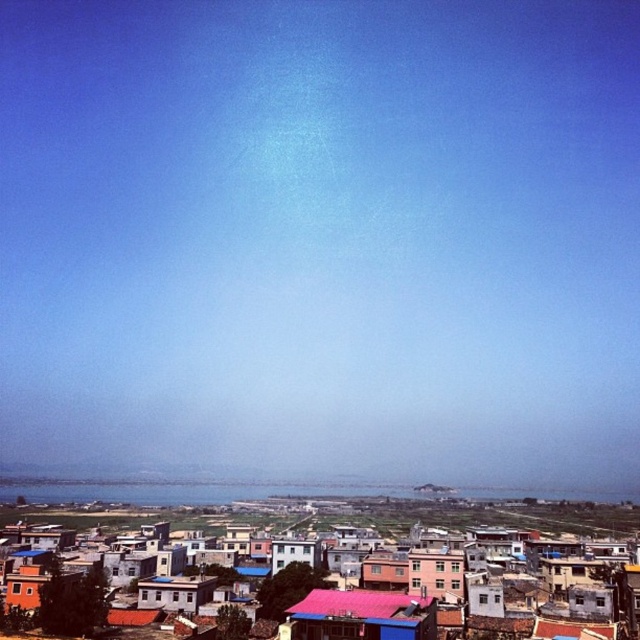
You are an architect analyzing the town layout. You need to determine which of the two buildings at the center is narrower. The buildings in question are the pink matte building at center and the white painted wood hut at center. Which one is narrower?

The pink matte building at center is thinner than the white painted wood hut at center, so the pink matte building at center is narrower.

You are standing at the edge of a village overlooking the red corrugated metal roof at center. If you walk straight towards it for 70 meters, will you reach the roof before you?

The distance between you and the red corrugated metal roof at center is 77.72 meters. After walking 70 meters, you will still be 7.72 meters away from the roof, so you won not reach it.